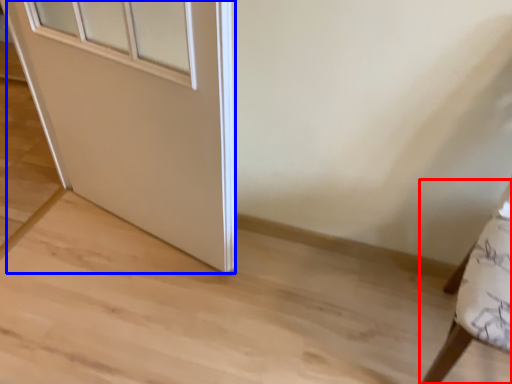
Question: Which object appears closest to the camera in this image, furniture (highlighted by a red box) or door (highlighted by a blue box)?

Choices:
 (A) furniture
 (B) door

Answer: (A)